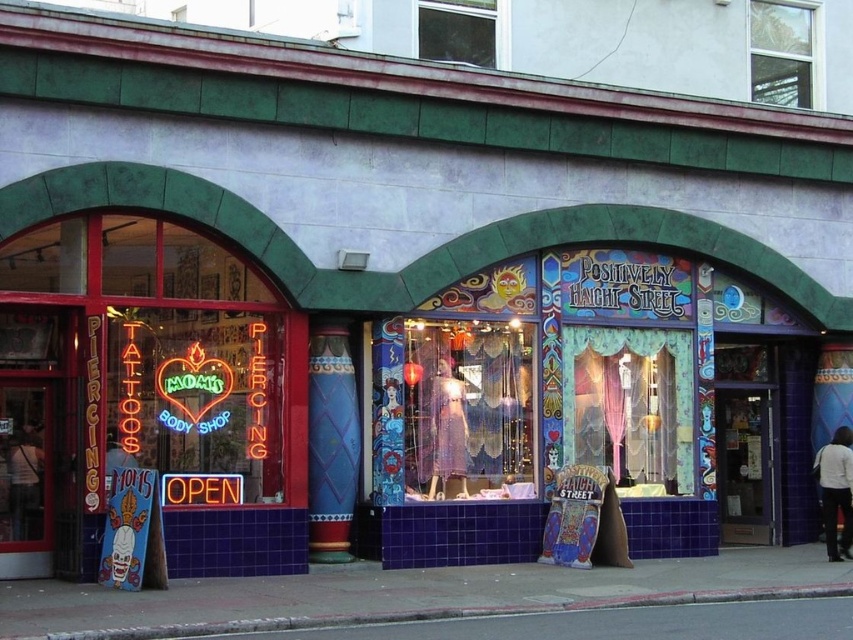
You are a customer entering the store and need to step over an obstacle. Which object between the concrete at lower center and the translucent fabric curtain at center is larger and would require more careful navigation?

The concrete at lower center is bigger than the translucent fabric curtain at center, so it would require more careful navigation.

You are a customer standing at the entrance of the tattoo shop. You see a translucent fabric dress at center and a translucent fabric curtain at center. Which item is closer to you?

The translucent fabric dress at center is closer to the viewer than the translucent fabric curtain at center.

You are standing in front of the storefront and want to take a photo. There are two points marked on the facade, one at coordinates point (381,332) and the other at point (569,406). Which point will appear closer to the center of your camera view?

Point (381,332) is closer to the camera than point (569,406), so it will appear closer to the center of your camera view.